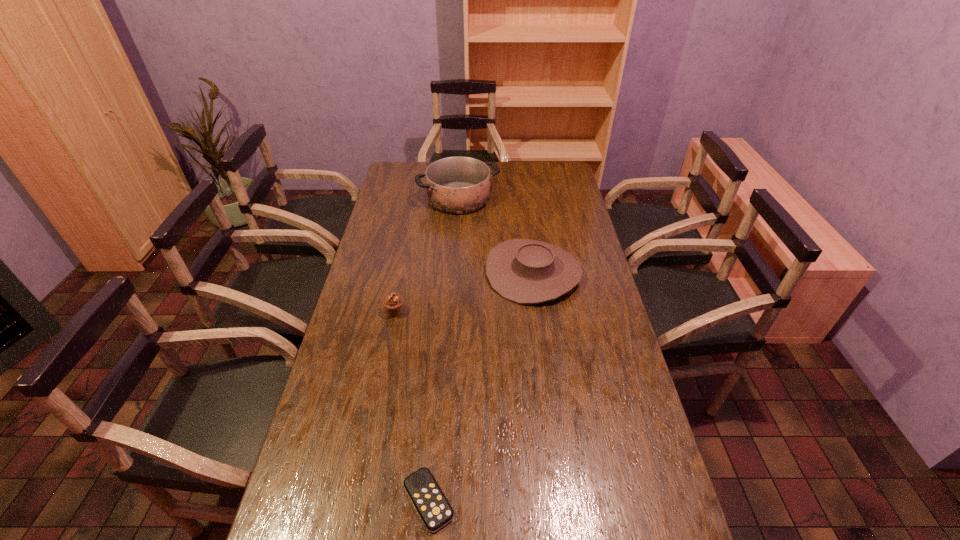
Image resolution: width=960 pixels, height=540 pixels. Find the location of `object that is the third nearest to the cowboy hat`. object that is the third nearest to the cowboy hat is located at coordinates (431, 504).

Where is `vacant space that satisfies the following two spatial constraints: 1. on the back side of the cowboy hat; 2. on the right side of the muffin`? vacant space that satisfies the following two spatial constraints: 1. on the back side of the cowboy hat; 2. on the right side of the muffin is located at coordinates (402, 273).

Find the location of a particular element. free location that satisfies the following two spatial constraints: 1. on the back side of the tallest object; 2. on the right side of the remote control is located at coordinates (453, 198).

I want to click on free space that satisfies the following two spatial constraints: 1. on the back side of the remote control; 2. on the right side of the farthest object, so click(453, 198).